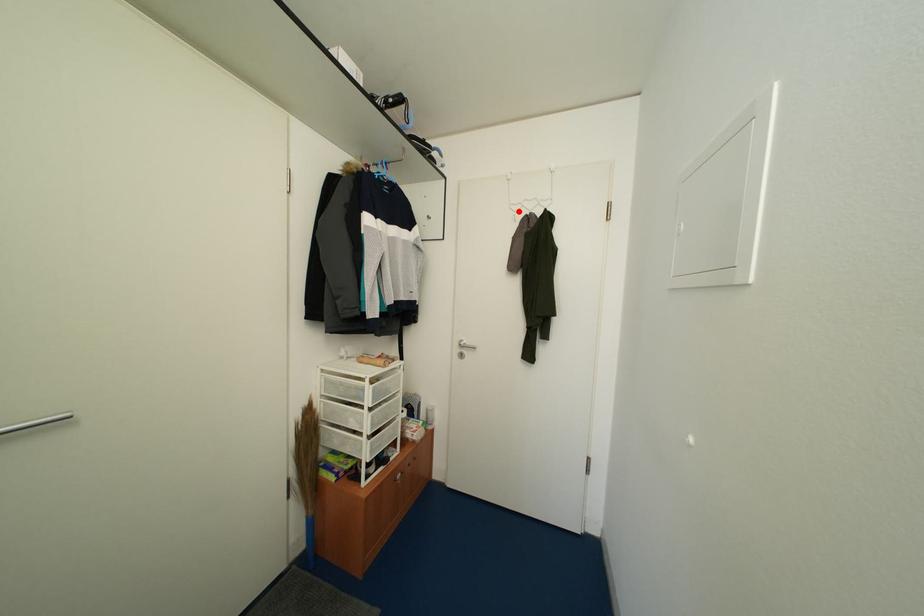
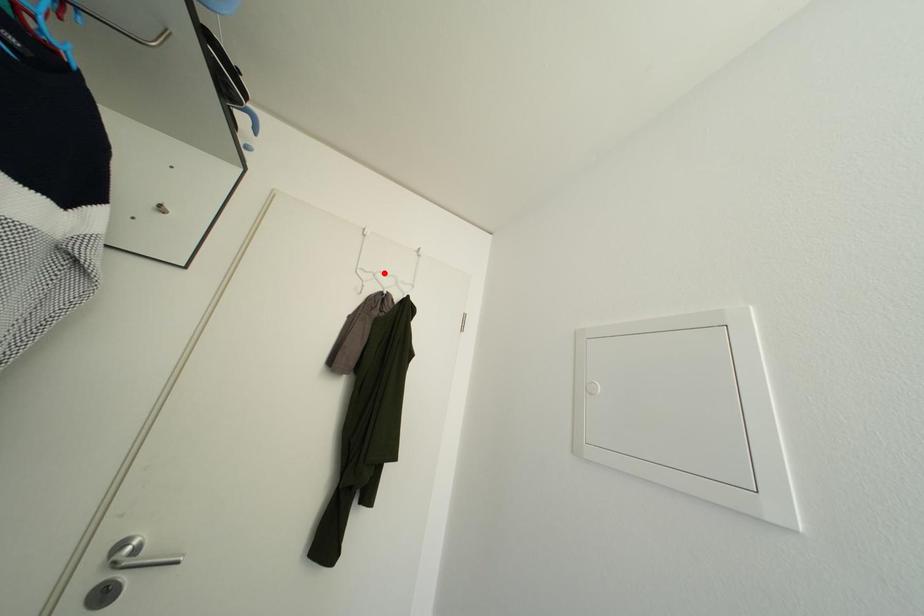
I am providing you with two images of the same scene from different viewpoints. A red point is marked on the first image and another point is marked on the second image. Is the red point in image1 aligned with the point shown in image2?

No